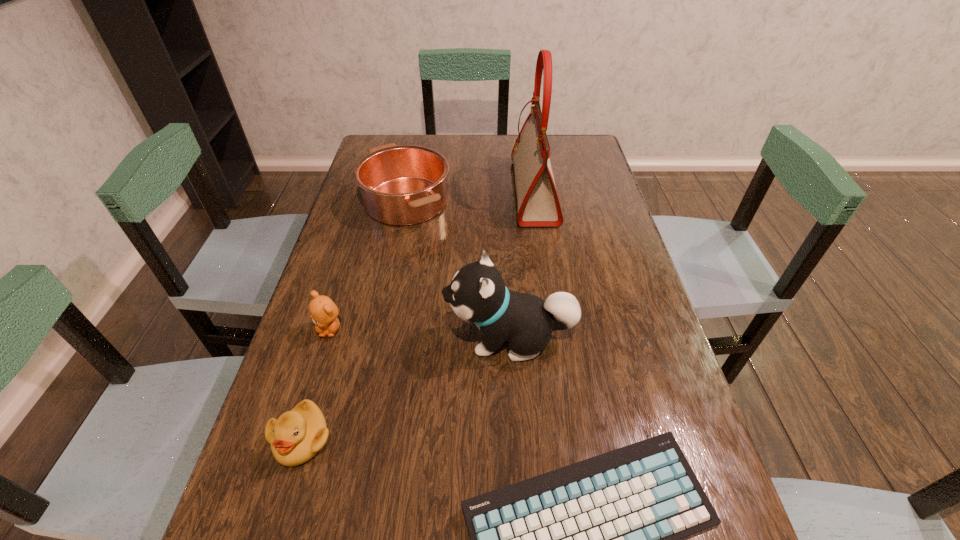
Where is `blank area in the image that satisfies the following two spatial constraints: 1. at the face of the second tallest object; 2. on the front-facing side of the duckling`? blank area in the image that satisfies the following two spatial constraints: 1. at the face of the second tallest object; 2. on the front-facing side of the duckling is located at coordinates (516, 438).

You are a GUI agent. You are given a task and a screenshot of the screen. Output one action in this format:
    pyautogui.click(x=<x>, y=<y>)
    Task: Click on the free space that satisfies the following two spatial constraints: 1. on the front side of the tallest object; 2. at the face of the fifth shortest object
    The height and width of the screenshot is (540, 960).
    Given the screenshot: What is the action you would take?
    pyautogui.click(x=557, y=338)